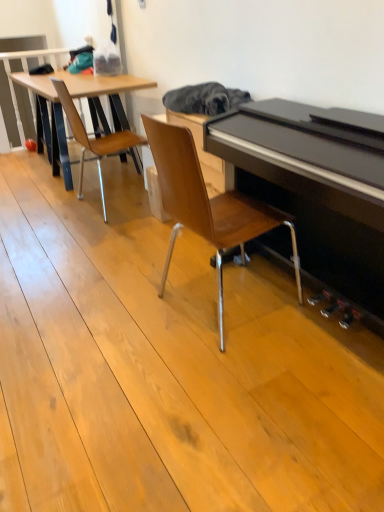
The width and height of the screenshot is (384, 512). Describe the element at coordinates (207, 205) in the screenshot. I see `wooden chair at center, arranged as the 1th chair when viewed from the right` at that location.

Find the location of a particular element. wooden chair at center, which appears as the 2th chair when viewed from the back is located at coordinates (207, 205).

You are a GUI agent. You are given a task and a screenshot of the screen. Output one action in this format:
    pyautogui.click(x=<x>, y=<y>)
    Task: Click on the wooden chair at left, the second chair positioned from the front
    Image resolution: width=384 pixels, height=512 pixels.
    Given the screenshot: What is the action you would take?
    pyautogui.click(x=94, y=138)

What is the approximate width of wooden chair at left, arranged as the second chair when viewed from the right?

22.47 inches.

Describe the element at coordinates (94, 138) in the screenshot. I see `wooden chair at left, which is the 1th chair from back to front` at that location.

At what (x,y) coordinates should I click in order to perform the action: click on wooden chair at center, which is the first chair from front to back. Please return your answer as a coordinate pair (x, y). Looking at the image, I should click on (207, 205).

Is wooden chair at left, arranged as the second chair when viewed from the right, to the left of wooden chair at center, which appears as the 2th chair when viewed from the back, from the viewer's perspective?

Yes, wooden chair at left, arranged as the second chair when viewed from the right, is to the left of wooden chair at center, which appears as the 2th chair when viewed from the back.

Considering the relative positions of wooden chair at left, which is the first chair from left to right, and wooden chair at center, arranged as the 1th chair when viewed from the right, in the image provided, is wooden chair at left, which is the first chair from left to right, behind wooden chair at center, arranged as the 1th chair when viewed from the right,?

Yes, wooden chair at left, which is the first chair from left to right, is behind wooden chair at center, arranged as the 1th chair when viewed from the right.

Considering the positions of points (116, 153) and (231, 210), is point (116, 153) closer to camera compared to point (231, 210)?

No, (116, 153) is further to viewer.

From the image's perspective, is wooden chair at left, the second chair positioned from the front, located above wooden chair at center, which is the first chair from front to back?

Yes, from the image's perspective, wooden chair at left, the second chair positioned from the front, is above wooden chair at center, which is the first chair from front to back.

From a real-world perspective, is wooden chair at left, arranged as the second chair when viewed from the right, physically above wooden chair at center, which is the first chair from front to back?

Incorrect, from a real-world perspective, wooden chair at left, arranged as the second chair when viewed from the right, is lower than wooden chair at center, which is the first chair from front to back.

Based on the photo, considering the relative sizes of wooden chair at left, arranged as the second chair when viewed from the right, and wooden chair at center, which appears as the second chair when viewed from the left, in the image provided, is wooden chair at left, arranged as the second chair when viewed from the right, wider than wooden chair at center, which appears as the second chair when viewed from the left,?

No.

Who is taller, wooden chair at left, the second chair positioned from the front, or wooden chair at center, arranged as the 1th chair when viewed from the right?

wooden chair at center, arranged as the 1th chair when viewed from the right.

Between wooden chair at left, the second chair positioned from the front, and wooden chair at center, which appears as the 2th chair when viewed from the back, which one has smaller size?

Smaller between the two is wooden chair at left, the second chair positioned from the front.

Can we say wooden chair at left, which is the 1th chair from back to front, lies outside wooden chair at center, which appears as the 2th chair when viewed from the back?

Yes.

Could you tell me if wooden chair at left, which is the 1th chair from back to front, is turned towards wooden chair at center, which appears as the second chair when viewed from the left?

No, wooden chair at left, which is the 1th chair from back to front, is not facing towards wooden chair at center, which appears as the second chair when viewed from the left.

What's the angular difference between wooden chair at left, which is the 1th chair from back to front, and wooden chair at center, arranged as the 1th chair when viewed from the right,'s facing directions?

The angular difference between wooden chair at left, which is the 1th chair from back to front, and wooden chair at center, arranged as the 1th chair when viewed from the right, is 0.000723 degrees.

Measure the distance between wooden chair at left, arranged as the second chair when viewed from the right, and wooden chair at center, which is the first chair from front to back.

wooden chair at left, arranged as the second chair when viewed from the right, and wooden chair at center, which is the first chair from front to back, are 3.96 feet apart from each other.

At what (x,y) coordinates should I click in order to perform the action: click on chair that appears on the right of wooden chair at left, arranged as the second chair when viewed from the right. Please return your answer as a coordinate pair (x, y). The image size is (384, 512). Looking at the image, I should click on pos(207,205).

Which object is positioned more to the left, wooden chair at center, which is the first chair from front to back, or wooden chair at left, the second chair positioned from the front?

Positioned to the left is wooden chair at left, the second chair positioned from the front.

Relative to wooden chair at left, arranged as the second chair when viewed from the right, is wooden chair at center, which appears as the 2th chair when viewed from the back, in front or behind?

Clearly, wooden chair at center, which appears as the 2th chair when viewed from the back, is in front of wooden chair at left, arranged as the second chair when viewed from the right.

Which point is more forward, (155, 156) or (80, 192)?

Point (155, 156)

From the image's perspective, between wooden chair at center, which appears as the second chair when viewed from the left, and wooden chair at left, arranged as the second chair when viewed from the right, which one is located above?

From the image's view, wooden chair at left, arranged as the second chair when viewed from the right, is above.

From a real-world perspective, is wooden chair at center, which appears as the 2th chair when viewed from the back, physically above wooden chair at left, which is the 1th chair from back to front?

Yes.

Based on the photo, which object is thinner, wooden chair at center, which is the first chair from front to back, or wooden chair at left, which is the first chair from left to right?

wooden chair at left, which is the first chair from left to right, is thinner.

Between wooden chair at center, which appears as the second chair when viewed from the left, and wooden chair at left, the second chair positioned from the front, which one has less height?

Standing shorter between the two is wooden chair at left, the second chair positioned from the front.

Between wooden chair at center, which is the first chair from front to back, and wooden chair at left, which is the first chair from left to right, which one has larger size?

Bigger between the two is wooden chair at center, which is the first chair from front to back.

Is wooden chair at center, which is the first chair from front to back, inside the boundaries of wooden chair at left, which is the first chair from left to right, or outside?

The correct answer is: outside.

Are wooden chair at center, which appears as the 2th chair when viewed from the back, and wooden chair at left, the second chair positioned from the front, located far from each other?

Indeed, wooden chair at center, which appears as the 2th chair when viewed from the back, is not near wooden chair at left, the second chair positioned from the front.

Could you tell me if wooden chair at center, which appears as the second chair when viewed from the left, is facing wooden chair at left, which is the 1th chair from back to front?

No, wooden chair at center, which appears as the second chair when viewed from the left, is not turned towards wooden chair at left, which is the 1th chair from back to front.

What's the angular difference between wooden chair at center, which appears as the 2th chair when viewed from the back, and wooden chair at left, which is the first chair from left to right,'s facing directions?

They differ by 0.000723 degrees in their facing directions.

At what (x,y) coordinates should I click in order to perform the action: click on chair in front of the wooden chair at left, the second chair positioned from the front. Please return your answer as a coordinate pair (x, y). The height and width of the screenshot is (512, 384). Looking at the image, I should click on (207, 205).

This screenshot has height=512, width=384. I want to click on chair that appears in front of the wooden chair at left, which is the first chair from left to right, so click(207, 205).

Image resolution: width=384 pixels, height=512 pixels. What are the coordinates of `chair behind the wooden chair at center, which appears as the 2th chair when viewed from the back` in the screenshot? It's located at (94, 138).